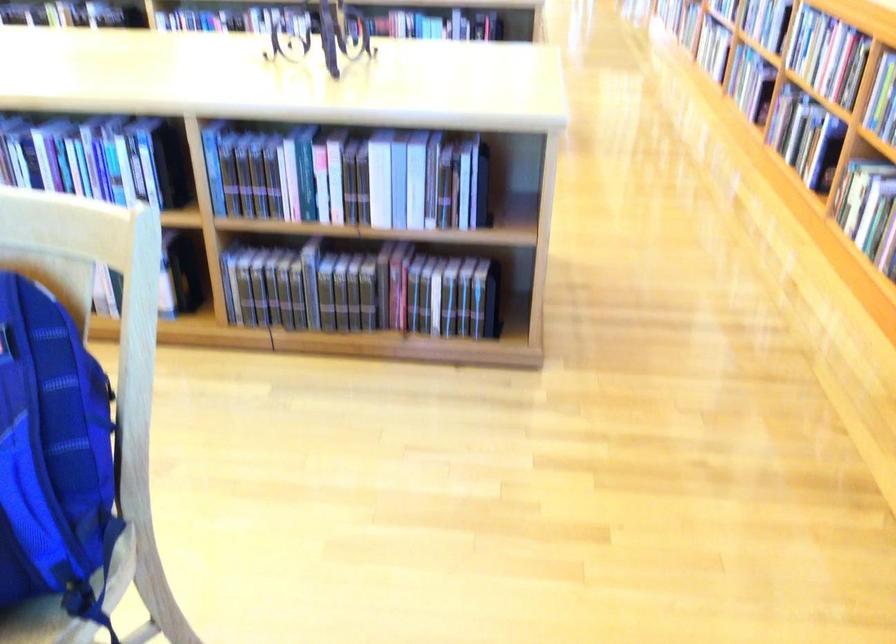
Identify the location of chair backrest. This screenshot has width=896, height=644. (67, 212).